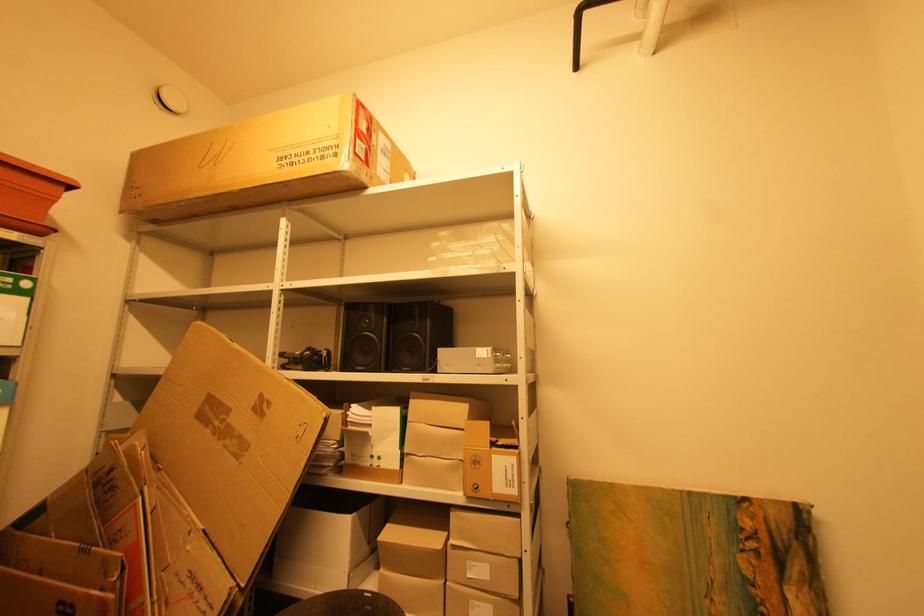
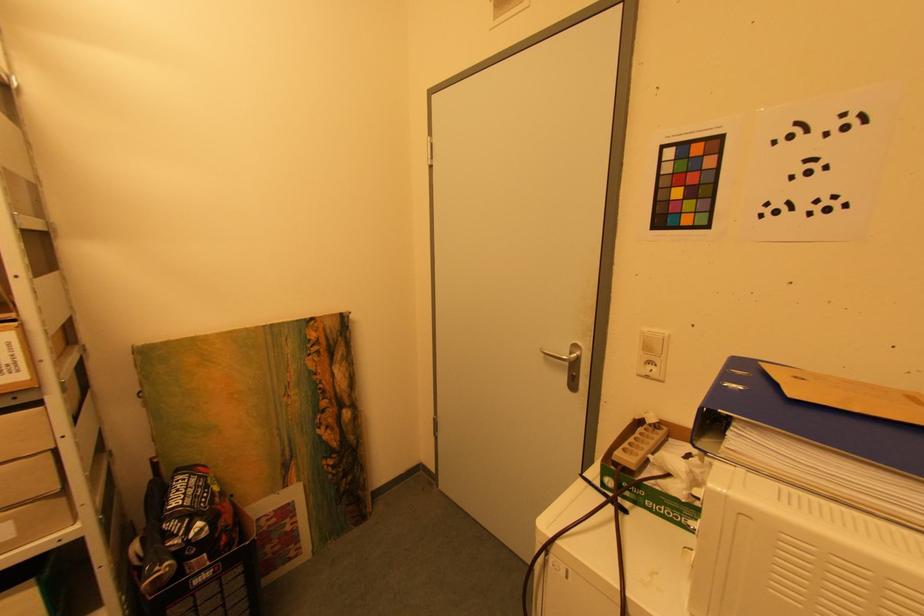
How did the camera likely rotate?

The rotation direction of the camera is right-down.